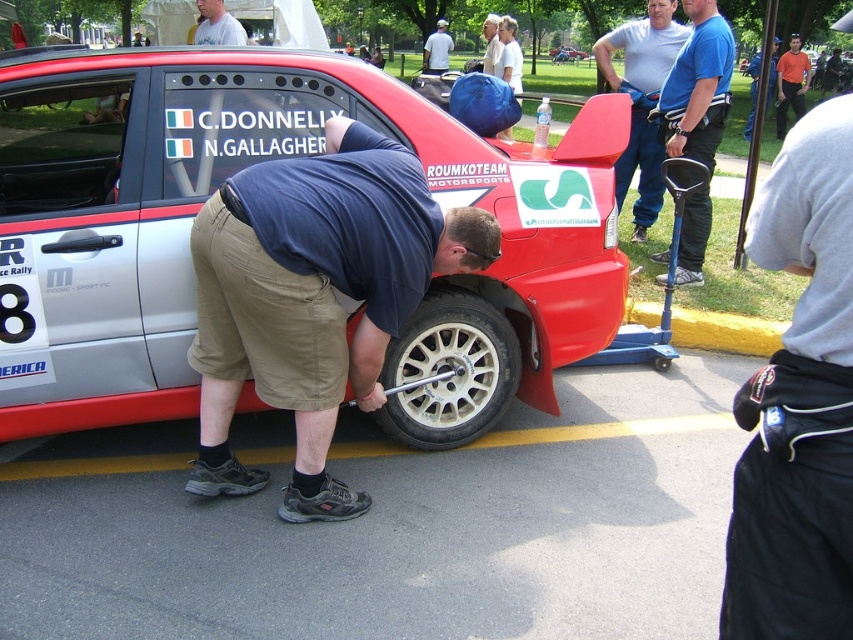
You are a spectator at the rally car preparation area and notice the orange shirt at upper right. Where exactly is the orange shirt located in relation to the central red and silver rally car?

The orange shirt at upper right is located at point 0.147 on the x axis and 0.883 on the y axis relative to the central red and silver rally car.

What is the exact coordinate location of the metallic silver car at center?

The metallic silver car at center is located at point [231,173].